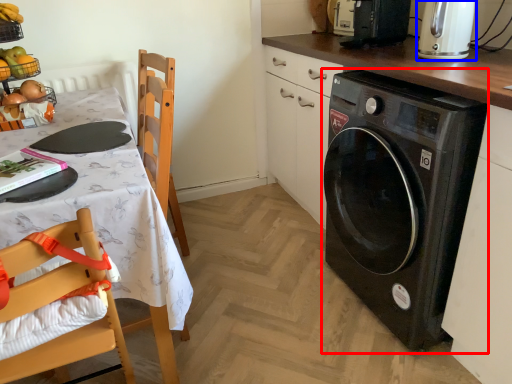
Question: Which object appears farthest to the camera in this image, washing machine (highlighted by a red box) or kitchen appliance (highlighted by a blue box)?

Choices:
 (A) washing machine
 (B) kitchen appliance

Answer: (B)